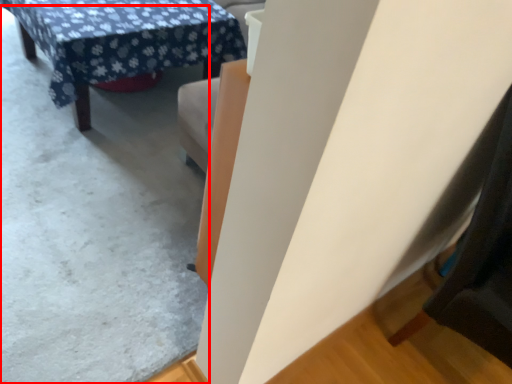
Question: In this image, where is concrete (annotated by the red box) located relative to table?

Choices:
 (A) right
 (B) left

Answer: (B)